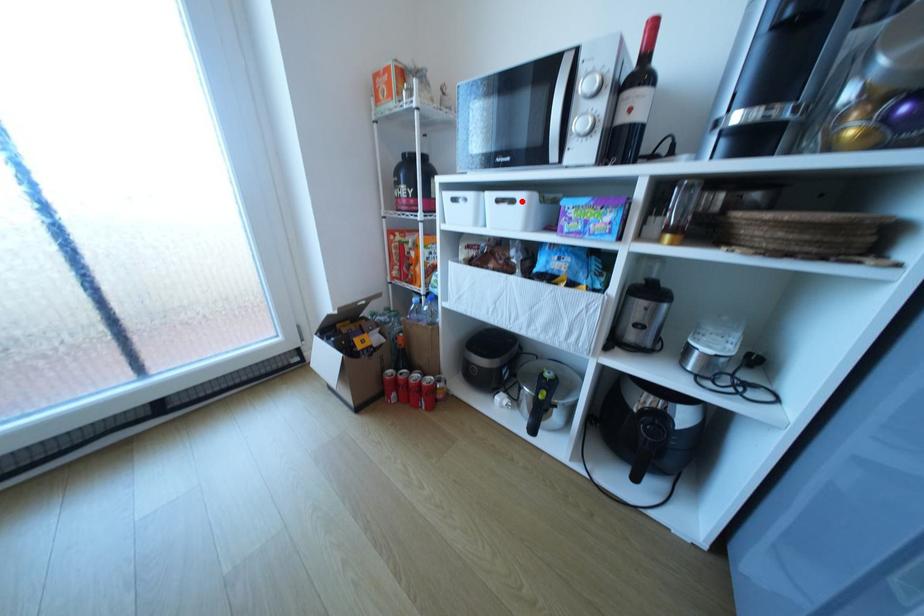
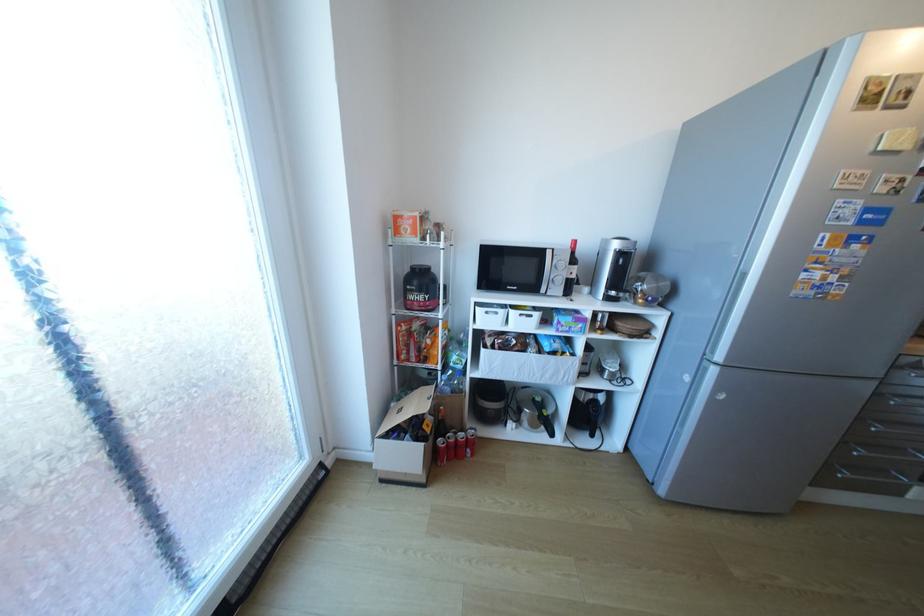
Question: I am providing you with two images of the same scene from different viewpoints. A red point is shown in image1. For the corresponding object point in image2, is it positioned nearer or farther from the camera?

Choices:
 (A) Nearer
 (B) Farther

Answer: (B)